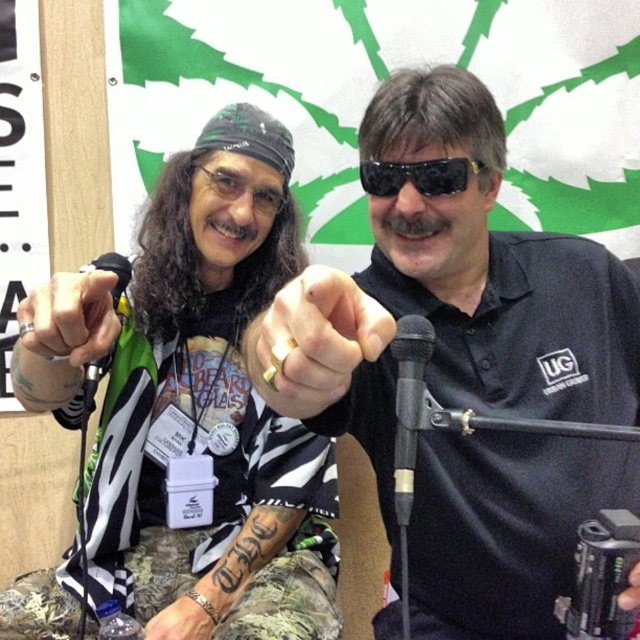
You are a photographer at the event and need to adjust the lighting so that both the black matte sunglasses at center and the black plastic sunglasses at center are equally visible. Which one should you move closer to the light source to achieve this?

The black matte sunglasses at center should be moved closer to the light source since they are positioned to the left of the black plastic sunglasses at center, and adjusting their position can help balance their visibility.

You are standing in front of the image and want to know how far the point at coordinates point (x=413, y=397) is from the camera. Can you determine the distance?

The point (x=413, y=397) is 31.01 inches away from the camera.